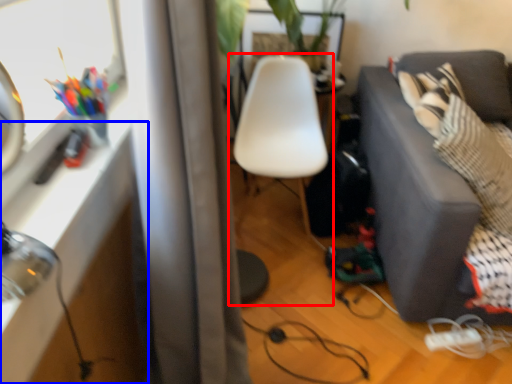
Question: Which of the following is the closest to the observer, chair (highlighted by a red box) or table (highlighted by a blue box)?

Choices:
 (A) chair
 (B) table

Answer: (B)